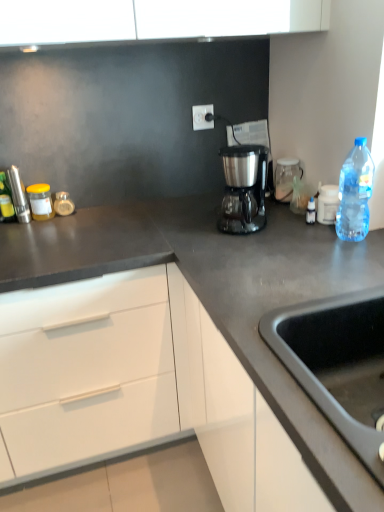
Question: Is white plastic container at upper right, the 1th appliance in the front-to-back sequence, at the back of white plastic electric outlet at upper center?

Choices:
 (A) no
 (B) yes

Answer: (A)

Question: Does white plastic electric outlet at upper center lie in front of white plastic container at upper right, the second appliance from the left?

Choices:
 (A) no
 (B) yes

Answer: (A)

Question: Is white plastic electric outlet at upper center surrounding white plastic container at upper right, the second appliance from the left?

Choices:
 (A) no
 (B) yes

Answer: (A)

Question: Is white plastic electric outlet at upper center positioned beyond the bounds of white plastic container at upper right, which is counted as the second appliance, starting from the back?

Choices:
 (A) no
 (B) yes

Answer: (B)

Question: Does white plastic electric outlet at upper center have a lesser width compared to white plastic container at upper right, the second appliance from the left?

Choices:
 (A) yes
 (B) no

Answer: (A)

Question: Is white plastic electric outlet at upper center in contact with white plastic container at upper right, the 1th appliance in the front-to-back sequence?

Choices:
 (A) yes
 (B) no

Answer: (B)

Question: From the image's perspective, is white plastic electric outlet at upper center located beneath satin metallic coffee maker at center?

Choices:
 (A) yes
 (B) no

Answer: (B)

Question: Is white plastic electric outlet at upper center positioned with its back to satin metallic coffee maker at center?

Choices:
 (A) yes
 (B) no

Answer: (B)

Question: Is white plastic electric outlet at upper center oriented towards satin metallic coffee maker at center?

Choices:
 (A) no
 (B) yes

Answer: (B)

Question: Is white plastic electric outlet at upper center far away from satin metallic coffee maker at center?

Choices:
 (A) yes
 (B) no

Answer: (B)

Question: Is the surface of white plastic electric outlet at upper center in direct contact with satin metallic coffee maker at center?

Choices:
 (A) yes
 (B) no

Answer: (B)

Question: Is white plastic electric outlet at upper center smaller than satin metallic coffee maker at center?

Choices:
 (A) yes
 (B) no

Answer: (A)

Question: From a real-world perspective, is satin metallic coffee maker at center below translucent glass jar at left, the 1th bottle when ordered from back to front?

Choices:
 (A) yes
 (B) no

Answer: (B)